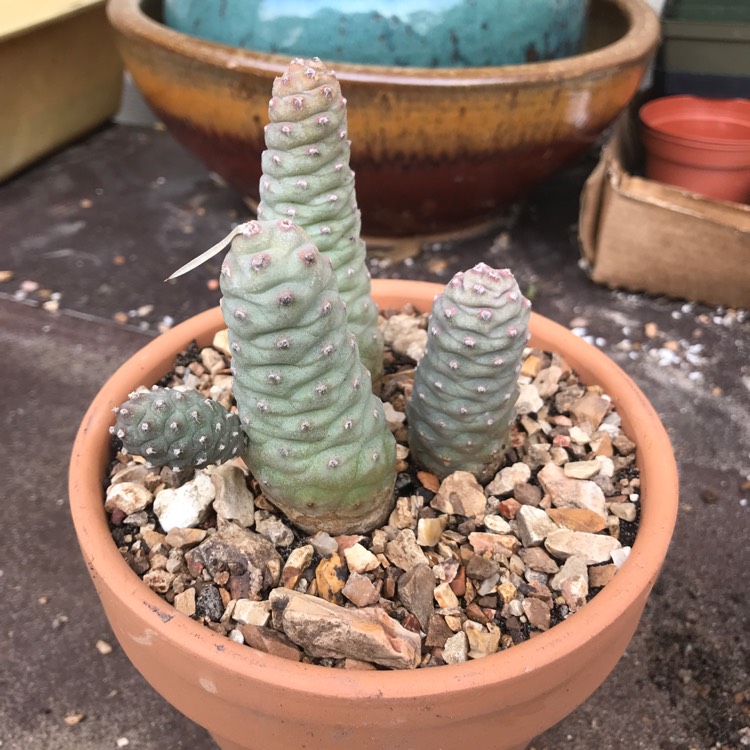
Image resolution: width=750 pixels, height=750 pixels. In order to click on cardboard box in this screenshot , I will do `click(618, 220)`.